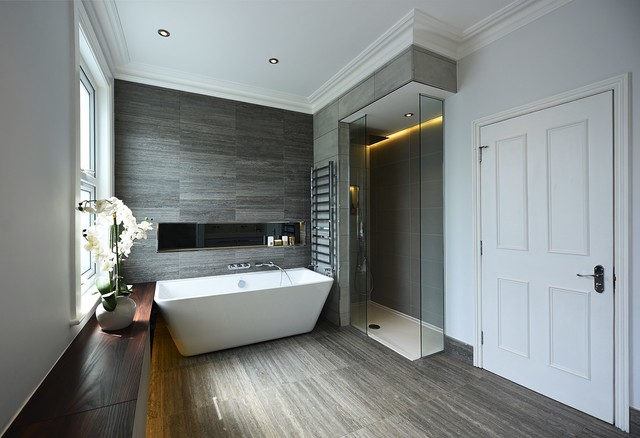
I want to click on door handle, so click(x=596, y=275).